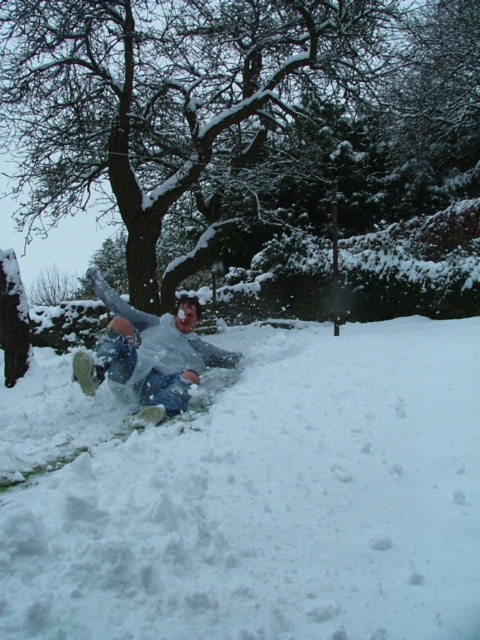
Between snow-covered tree at upper left and white matte snowboarder at center, which one has more height?

snow-covered tree at upper left is taller.

The image size is (480, 640). Describe the element at coordinates (165, 100) in the screenshot. I see `snow-covered tree at upper left` at that location.

The image size is (480, 640). I want to click on snow-covered tree at upper left, so (x=165, y=100).

Consider the image. Between white fluffy snow at center and white matte snowboarder at center, which one is positioned lower?

white fluffy snow at center is below.

Describe the element at coordinates (256, 497) in the screenshot. I see `white fluffy snow at center` at that location.

Image resolution: width=480 pixels, height=640 pixels. What do you see at coordinates (256, 497) in the screenshot? I see `white fluffy snow at center` at bounding box center [256, 497].

Where is `white fluffy snow at center`? This screenshot has height=640, width=480. white fluffy snow at center is located at coordinates (256, 497).

Can you confirm if white fluffy snow at center is bigger than snow-covered tree at upper left?

No, white fluffy snow at center is not bigger than snow-covered tree at upper left.

Which is below, white fluffy snow at center or snow-covered tree at upper left?

white fluffy snow at center is lower down.

Is point (370, 436) less distant than point (260, 116)?

Yes.

Image resolution: width=480 pixels, height=640 pixels. What are the coordinates of `white fluffy snow at center` in the screenshot? It's located at (256, 497).